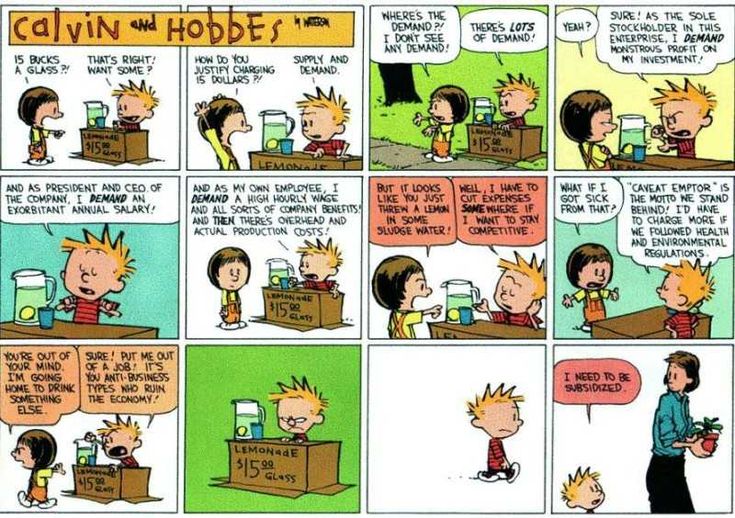
Find the location of a particular element. blue cup is located at coordinates (254, 435), (90, 460), (40, 315), (284, 285), (467, 313), (667, 311), (637, 152), (487, 120), (286, 145), (98, 122).